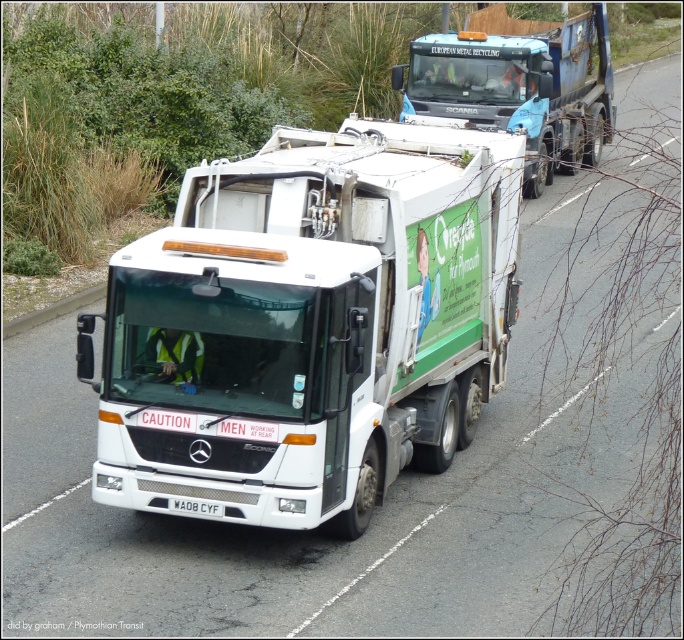
Does white matte garbage truck at center have a smaller size compared to blue metallic garbage truck at center?

Actually, white matte garbage truck at center might be larger than blue metallic garbage truck at center.

Who is higher up, white matte garbage truck at center or blue metallic garbage truck at center?

blue metallic garbage truck at center is above.

Which is in front, point (365, 372) or point (453, 77)?

Point (365, 372) is more forward.

Image resolution: width=684 pixels, height=640 pixels. I want to click on white matte garbage truck at center, so click(x=308, y=324).

Consider the image. Measure the distance between blue metallic garbage truck at center and white plastic license plate at center.

They are 57.10 feet apart.

Is point (462, 56) behind point (192, 506)?

Yes, it is.

Does point (562, 88) lie in front of point (185, 512)?

No, (562, 88) is further to viewer.

The image size is (684, 640). In order to click on blue metallic garbage truck at center in this screenshot , I will do `click(518, 84)`.

Between white matte garbage truck at center and white plastic license plate at center, which one appears on the left side from the viewer's perspective?

white plastic license plate at center is more to the left.

Identify the location of white matte garbage truck at center. This screenshot has width=684, height=640. (308, 324).